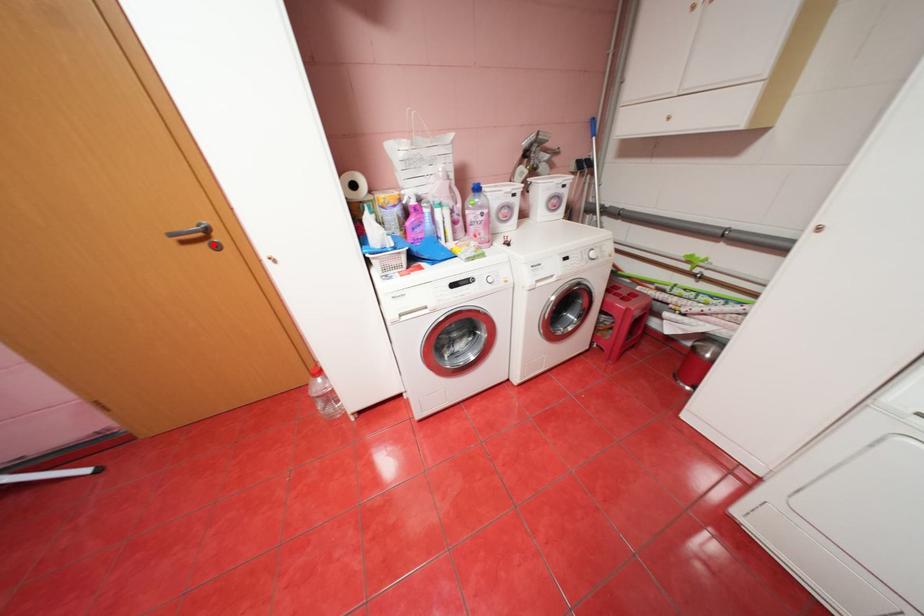
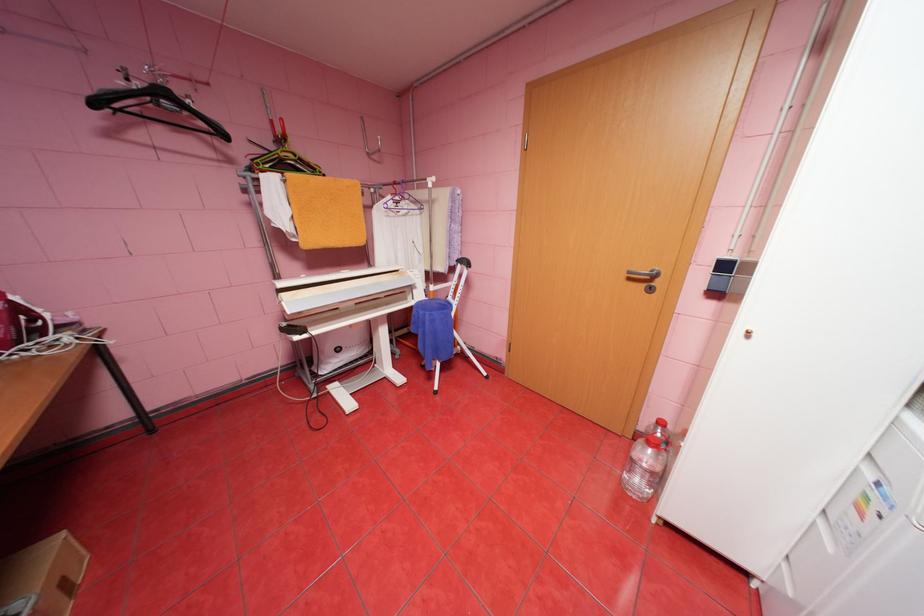
Where in the second image is the point corresponding to the highlighted location from the first image?

(650, 285)